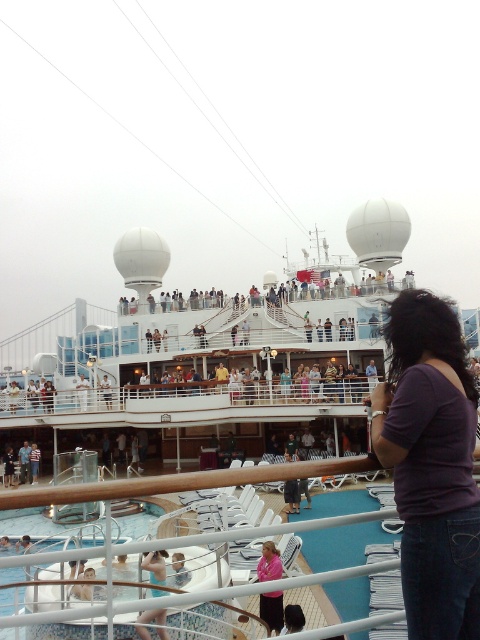
You are a photographer on the cruise ship deck and want to capture a photo of the pink fabric shirt at lower center without the purple matte shirt at lower right blocking it. What should you do?

Move the camera position backward so that the purple matte shirt at lower right is no longer in front of the pink fabric shirt at lower center.

You are standing on the cruise ship deck and notice a point marked at coordinates (432, 465). Based on the scene description, can you identify what this point is located on?

The point at coordinates (432, 465) is located on the purple matte shirt at lower right.

You are standing on the cruise ship deck and see the pink fabric shirt at lower center. There is a lifeboat located 156.30 feet away from it. Can you estimate whether the lifeboat is closer to the front or the back of the ship based on the shirt location?

The pink fabric shirt at lower center is 156.30 feet away from the lifeboat. Since the shirt is located at the lower center of the ship, the lifeboat is likely positioned towards the front or back of the ship, but without additional information about the ship layout, we cannot determine the exact direction.